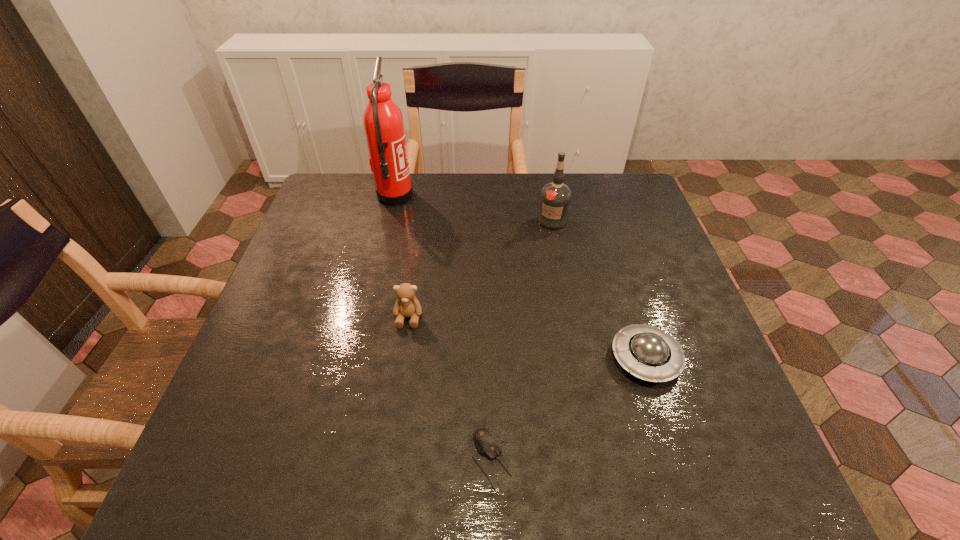
Locate an element on the screen. This screenshot has height=540, width=960. the farthest object is located at coordinates (383, 121).

Where is `the leftmost object`? the leftmost object is located at coordinates (383, 121).

Where is `vodka`? Image resolution: width=960 pixels, height=540 pixels. vodka is located at coordinates (555, 198).

Identify the location of the fourth shortest object. (555, 198).

I want to click on the third tallest object, so click(x=407, y=305).

I want to click on the fourth object from right to left, so click(x=407, y=305).

This screenshot has height=540, width=960. Identify the location of the rightmost object. (647, 352).

Where is `the fourth farthest object`? The height and width of the screenshot is (540, 960). the fourth farthest object is located at coordinates (647, 352).

Identify the location of the third object from right to left. The image size is (960, 540). (486, 444).

You are a GUI agent. You are given a task and a screenshot of the screen. Output one action in this format:
    pyautogui.click(x=<x>, y=<y>)
    Task: Click on the mouse
    
    Given the screenshot: What is the action you would take?
    pyautogui.click(x=486, y=444)